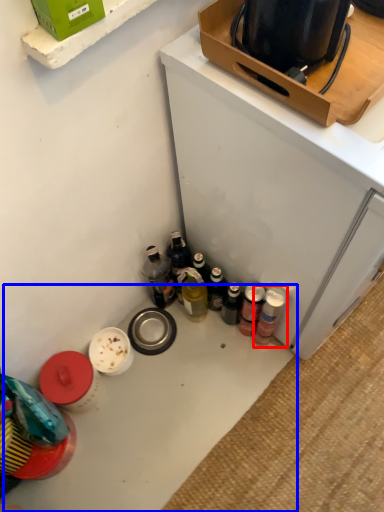
Question: Which object appears farthest to the camera in this image, bottle (highlighted by a red box) or table (highlighted by a blue box)?

Choices:
 (A) bottle
 (B) table

Answer: (A)